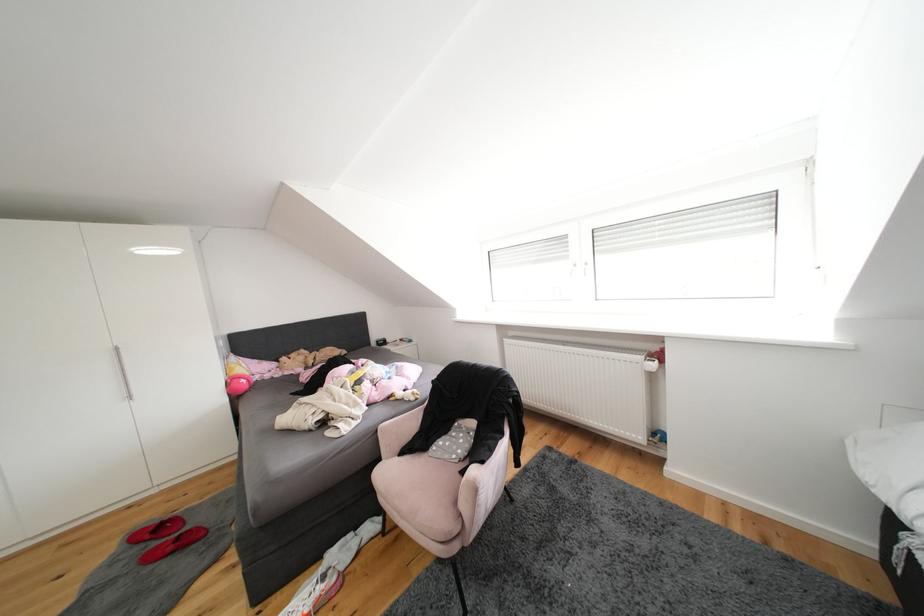
Where is `red slipper`? This screenshot has height=616, width=924. red slipper is located at coordinates (165, 538).